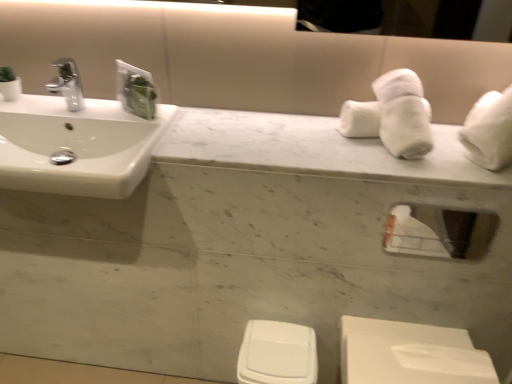
At what (x,y) coordinates should I click in order to perform the action: click on white plastic toilet bowl at lower center. Please return your answer as a coordinate pair (x, y). Looking at the image, I should click on (277, 353).

The image size is (512, 384). What do you see at coordinates (82, 136) in the screenshot? I see `white glossy sink at left` at bounding box center [82, 136].

You are a GUI agent. You are given a task and a screenshot of the screen. Output one action in this format:
    pyautogui.click(x=<x>, y=<y>)
    Task: Click on the clear glass mirror at upper right
    This screenshot has width=512, height=384.
    Given the screenshot: What is the action you would take?
    pyautogui.click(x=439, y=232)

Is white glossy sink at left a part of white plastic toilet bowl at lower center?

No, white glossy sink at left is not surrounded by white plastic toilet bowl at lower center.

Which is more to the left, white plastic toilet bowl at lower center or white glossy sink at left?

From the viewer's perspective, white glossy sink at left appears more on the left side.

Which object is thinner, white plastic toilet bowl at lower center or white glossy sink at left?

With smaller width is white plastic toilet bowl at lower center.

Does point (254, 368) lie behind point (120, 107)?

No.

Is white glossy toilet at lower right aimed at white plastic toilet bowl at lower center?

No, white glossy toilet at lower right is not oriented towards white plastic toilet bowl at lower center.

From a real-world perspective, which object stands above the other?

From a 3D spatial view, white glossy toilet at lower right is above.

Based on the photo, in the image, is white glossy toilet at lower right on the left side or the right side of white plastic toilet bowl at lower center?

In the image, white glossy toilet at lower right appears on the right side of white plastic toilet bowl at lower center.

How much distance is there between white glossy toilet at lower right and white plastic toilet bowl at lower center?

The distance of white glossy toilet at lower right from white plastic toilet bowl at lower center is 24.87 centimeters.

Identify the location of mirror on the right side of white glossy sink at left. This screenshot has width=512, height=384. (439, 232).

Is clear glass mirror at upper right inside white glossy sink at left?

No, white glossy sink at left does not contain clear glass mirror at upper right.

Does point (118, 140) come closer to viewer compared to point (464, 233)?

Yes, point (118, 140) is closer to viewer.

From a real-world perspective, does white glossy sink at left sit lower than clear glass mirror at upper right?

Actually, white glossy sink at left is physically above clear glass mirror at upper right in the real world.

Is white glossy toilet at lower right taller or shorter than white glossy sink at left?

Clearly, white glossy toilet at lower right is taller compared to white glossy sink at left.

Is point (481, 381) closer to camera compared to point (50, 129)?

Yes, it is in front of point (50, 129).

Which object is closer to the camera, white glossy toilet at lower right or white glossy sink at left?

white glossy sink at left.

Considering the sizes of objects white plastic toilet bowl at lower center and white glossy toilet at lower right in the image provided, who is bigger, white plastic toilet bowl at lower center or white glossy toilet at lower right?

With larger size is white glossy toilet at lower right.

Is white plastic toilet bowl at lower center positioned far away from white glossy toilet at lower right?

No, there isn't a large distance between white plastic toilet bowl at lower center and white glossy toilet at lower right.

Identify the location of toilet bowl lying on the left of white glossy toilet at lower right. The image size is (512, 384). (277, 353).

Which object is thinner, white glossy sink at left or white plastic toilet bowl at lower center?

With smaller width is white plastic toilet bowl at lower center.

Could white plastic toilet bowl at lower center be considered to be inside white glossy sink at left?

That's incorrect, white plastic toilet bowl at lower center is not inside white glossy sink at left.

How far apart are white glossy sink at left and white plastic toilet bowl at lower center?

white glossy sink at left and white plastic toilet bowl at lower center are 27.48 inches apart.

Which object is further away from the camera, white glossy sink at left or white plastic toilet bowl at lower center?

white plastic toilet bowl at lower center is more distant.

Does white marble counter top at center come behind white plastic toilet bowl at lower center?

No, the depth of white marble counter top at center is less than that of white plastic toilet bowl at lower center.

Identify the location of counter top located above the white plastic toilet bowl at lower center (from the image's perspective). (313, 148).

Which of these two, white marble counter top at center or white plastic toilet bowl at lower center, stands taller?

white plastic toilet bowl at lower center is taller.

Can you confirm if white marble counter top at center is thinner than white plastic toilet bowl at lower center?

In fact, white marble counter top at center might be wider than white plastic toilet bowl at lower center.

Where is `toilet bowl below the white glossy sink at left (from the image's perspective)`? Image resolution: width=512 pixels, height=384 pixels. toilet bowl below the white glossy sink at left (from the image's perspective) is located at coordinates (277, 353).

At what (x,y) coordinates should I click in order to perform the action: click on toilet bowl on the left of white glossy toilet at lower right. Please return your answer as a coordinate pair (x, y). Image resolution: width=512 pixels, height=384 pixels. Looking at the image, I should click on (277, 353).

When comparing their distances from white glossy sink at left, does clear glass mirror at upper right or white plastic toilet bowl at lower center seem further?

clear glass mirror at upper right.

From the image, which object appears to be nearer to clear glass mirror at upper right, white plastic toilet bowl at lower center or white glossy toilet at lower right?

white glossy toilet at lower right is positioned closer to the anchor clear glass mirror at upper right.

From the image, which object appears to be farther from white marble counter top at center, clear glass mirror at upper right or white glossy toilet at lower right?

Among the two, white glossy toilet at lower right is located further to white marble counter top at center.

From the image, which object appears to be nearer to white glossy sink at left, white marble counter top at center or clear glass mirror at upper right?

white marble counter top at center is positioned closer to the anchor white glossy sink at left.

Which object lies further to the anchor point white glossy toilet at lower right, white marble counter top at center or clear glass mirror at upper right?

white marble counter top at center is further to white glossy toilet at lower right.

Considering their positions, is white glossy toilet at lower right positioned closer to white glossy sink at left than clear glass mirror at upper right?

The object closer to white glossy sink at left is white glossy toilet at lower right.

Looking at the image, which one is located closer to white glossy sink at left, clear glass mirror at upper right or white marble counter top at center?

white marble counter top at center is positioned closer to the anchor white glossy sink at left.

Which object lies further to the anchor point clear glass mirror at upper right, white glossy sink at left or white marble counter top at center?

Among the two, white glossy sink at left is located further to clear glass mirror at upper right.

Image resolution: width=512 pixels, height=384 pixels. I want to click on porcelain situated between white glossy sink at left and clear glass mirror at upper right from left to right, so click(x=410, y=354).

Where is `toilet bowl located between white glossy sink at left and white glossy toilet at lower right in the left-right direction`? This screenshot has width=512, height=384. toilet bowl located between white glossy sink at left and white glossy toilet at lower right in the left-right direction is located at coordinates (277, 353).

At what (x,y) coordinates should I click in order to perform the action: click on counter top between white glossy sink at left and white glossy toilet at lower right from left to right. Please return your answer as a coordinate pair (x, y). Looking at the image, I should click on (313, 148).

Locate an element on the screen. This screenshot has height=384, width=512. porcelain that lies between clear glass mirror at upper right and white plastic toilet bowl at lower center from top to bottom is located at coordinates (410, 354).